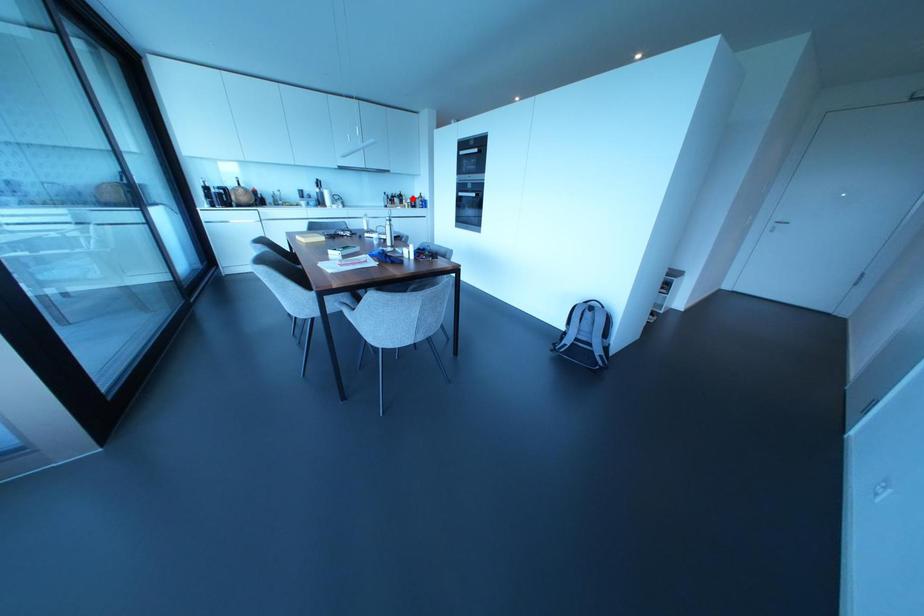
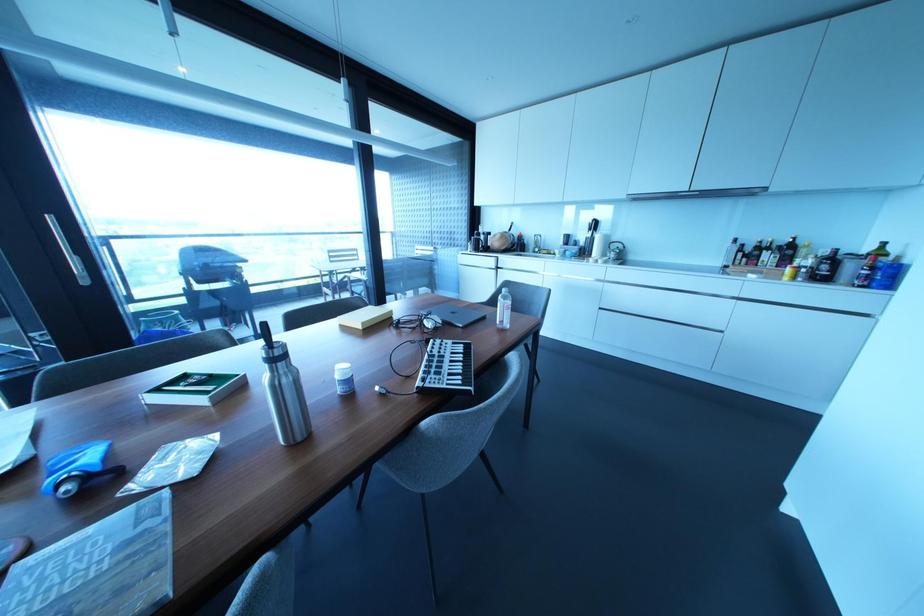
Question: I am providing you with two images of the same scene from different viewpoints. A red point is marked on the first image. Is the red point's position out of view in image 2?

Choices:
 (A) Yes
 (B) No

Answer: (B)